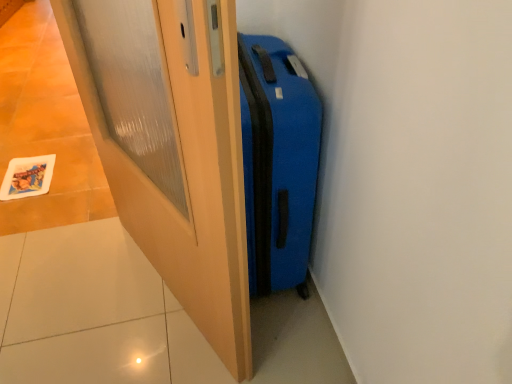
What do you see at coordinates (172, 147) in the screenshot? The height and width of the screenshot is (384, 512). I see `matte wood door at center` at bounding box center [172, 147].

Find the location of a particular element. The height and width of the screenshot is (384, 512). matte wood door at center is located at coordinates (172, 147).

You are a GUI agent. You are given a task and a screenshot of the screen. Output one action in this format:
    pyautogui.click(x=<x>, y=<y>)
    Task: Click on the blue matte suitcase at center
    
    Given the screenshot: What is the action you would take?
    tap(278, 162)

Measure the distance between blue matte suitcase at center and camera.

A distance of 92.13 centimeters exists between blue matte suitcase at center and camera.

What do you see at coordinates (278, 162) in the screenshot?
I see `blue matte suitcase at center` at bounding box center [278, 162].

In order to click on matte wood door at center in this screenshot , I will do tap(172, 147).

Is blue matte suitcase at center at the right side of matte wood door at center?

Yes, blue matte suitcase at center is to the right of matte wood door at center.

Who is more distant, blue matte suitcase at center or matte wood door at center?

blue matte suitcase at center.

Between point (254, 144) and point (188, 83), which one is positioned behind?

Point (254, 144)

From the image's perspective, which object appears higher, blue matte suitcase at center or matte wood door at center?

blue matte suitcase at center.

From a real-world perspective, is blue matte suitcase at center located beneath matte wood door at center?

Yes, from a real-world perspective, blue matte suitcase at center is beneath matte wood door at center.

Is blue matte suitcase at center wider or thinner than matte wood door at center?

Considering their sizes, blue matte suitcase at center looks broader than matte wood door at center.

Who is shorter, blue matte suitcase at center or matte wood door at center?

blue matte suitcase at center is shorter.

Based on their sizes in the image, would you say blue matte suitcase at center is bigger or smaller than matte wood door at center?

Considering their sizes, blue matte suitcase at center takes up more space than matte wood door at center.

Would you say blue matte suitcase at center is outside matte wood door at center?

Yes, blue matte suitcase at center is located beyond the bounds of matte wood door at center.

Is blue matte suitcase at center positioned far away from matte wood door at center?

Actually, blue matte suitcase at center and matte wood door at center are a little close together.

Is blue matte suitcase at center turned away from matte wood door at center?

No, matte wood door at center is not at the back of blue matte suitcase at center.

What's the angular difference between blue matte suitcase at center and matte wood door at center's facing directions?

The angular difference between blue matte suitcase at center and matte wood door at center is 23.8 degrees.

Identify the location of suitcase that is on the right side of matte wood door at center. (278, 162).

Consider the image. Is matte wood door at center to the left or to the right of blue matte suitcase at center in the image?

From the image, it's evident that matte wood door at center is to the left of blue matte suitcase at center.

Is matte wood door at center in front of or behind blue matte suitcase at center in the image?

matte wood door at center is positioned closer to the viewer than blue matte suitcase at center.

Is point (80, 52) closer or farther from the camera than point (283, 119)?

Point (80, 52) is positioned farther from the camera compared to point (283, 119).

From the image's perspective, which is below, matte wood door at center or blue matte suitcase at center?

matte wood door at center appears lower in the image.

From a real-world perspective, is matte wood door at center located higher than blue matte suitcase at center?

Correct, in the physical world, matte wood door at center is higher than blue matte suitcase at center.

Considering the relative sizes of matte wood door at center and blue matte suitcase at center in the image provided, is matte wood door at center wider than blue matte suitcase at center?

→ No, matte wood door at center is not wider than blue matte suitcase at center.

Considering the sizes of objects matte wood door at center and blue matte suitcase at center in the image provided, who is taller, matte wood door at center or blue matte suitcase at center?

matte wood door at center is taller.

Considering the relative sizes of matte wood door at center and blue matte suitcase at center in the image provided, is matte wood door at center bigger than blue matte suitcase at center?

No, matte wood door at center is not bigger than blue matte suitcase at center.

Can we say matte wood door at center lies outside blue matte suitcase at center?

That's correct, matte wood door at center is outside of blue matte suitcase at center.

Would you consider matte wood door at center to be distant from blue matte suitcase at center?

That's not correct — matte wood door at center is a little close to blue matte suitcase at center.

Is matte wood door at center aimed at blue matte suitcase at center?

Yes, matte wood door at center is oriented towards blue matte suitcase at center.

At what (x,y) coordinates should I click in order to perform the action: click on door above the blue matte suitcase at center (from a real-world perspective). Please return your answer as a coordinate pair (x, y). Looking at the image, I should click on (172, 147).

In the image, there is a matte wood door at center. Where is `suitcase above it (from the image's perspective)`? This screenshot has height=384, width=512. suitcase above it (from the image's perspective) is located at coordinates (278, 162).

This screenshot has height=384, width=512. What are the coordinates of `door on the left of blue matte suitcase at center` in the screenshot? It's located at (172, 147).